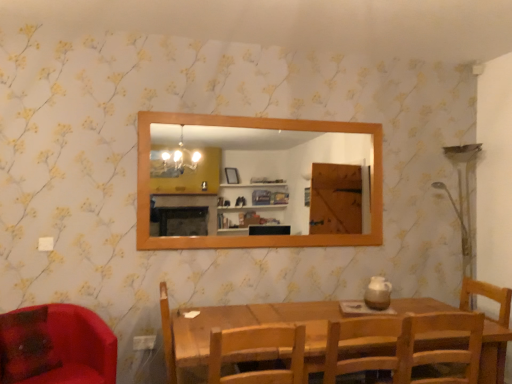
Question: Does point (451, 377) appear closer or farther from the camera than point (371, 360)?

Choices:
 (A) farther
 (B) closer

Answer: (A)

Question: From the image's perspective, relative to wooden chair at center, arranged as the third chair when viewed from the left, is wooden chair at lower right, which is counted as the 1th chair, starting from the right, above or below?

Choices:
 (A) below
 (B) above

Answer: (A)

Question: Which object is the closest to the wooden mirror at upper center?

Choices:
 (A) wooden chair at center, arranged as the third chair when viewed from the left
 (B) wooden chair at lower right, which is counted as the 1th chair, starting from the right
 (C) matte red chair at lower left, which appears as the fourth chair when viewed from the right
 (D) wooden chair at center, arranged as the third chair when viewed from the right

Answer: (C)

Question: Considering the real-world distances, which object is farthest from the wooden mirror at upper center?

Choices:
 (A) wooden chair at center, arranged as the third chair when viewed from the right
 (B) matte red chair at lower left, placed as the 1th chair when sorted from left to right
 (C) wooden chair at center, arranged as the third chair when viewed from the left
 (D) wooden chair at lower right, which is counted as the 1th chair, starting from the right

Answer: (A)